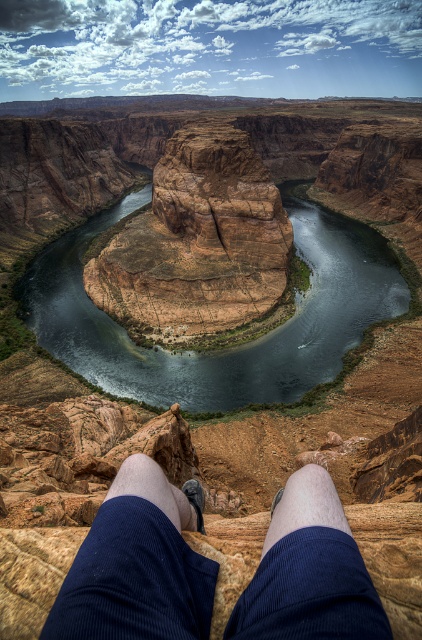
Does brown rock formation at center have a lesser width compared to pale skin at lower center?

No.

Is brown rock formation at center further to the viewer compared to pale skin at lower center?

Yes, it is.

Does point (213, 250) come behind point (321, 483)?

Yes.

Where is `brown rock formation at center`? Image resolution: width=422 pixels, height=640 pixels. brown rock formation at center is located at coordinates (197, 243).

In the scene shown: Which of these two, blue corduroy shorts at lower center or brown rock formation at center, stands taller?

With more height is brown rock formation at center.

You are a GUI agent. You are given a task and a screenshot of the screen. Output one action in this format:
    pyautogui.click(x=<x>, y=<y>)
    Task: Click on the blue corduroy shorts at lower center
    The width and height of the screenshot is (422, 640).
    Given the screenshot: What is the action you would take?
    pyautogui.click(x=137, y=566)

Between brown rock river at center and blue corduroy pants at lower center, which one is positioned lower?

blue corduroy pants at lower center is below.

Which is more to the right, brown rock river at center or blue corduroy pants at lower center?

blue corduroy pants at lower center

Between point (281, 369) and point (186, 500), which one is positioned behind?

The point (281, 369) is behind.

Identify the location of brown rock river at center. The height and width of the screenshot is (640, 422). (226, 348).